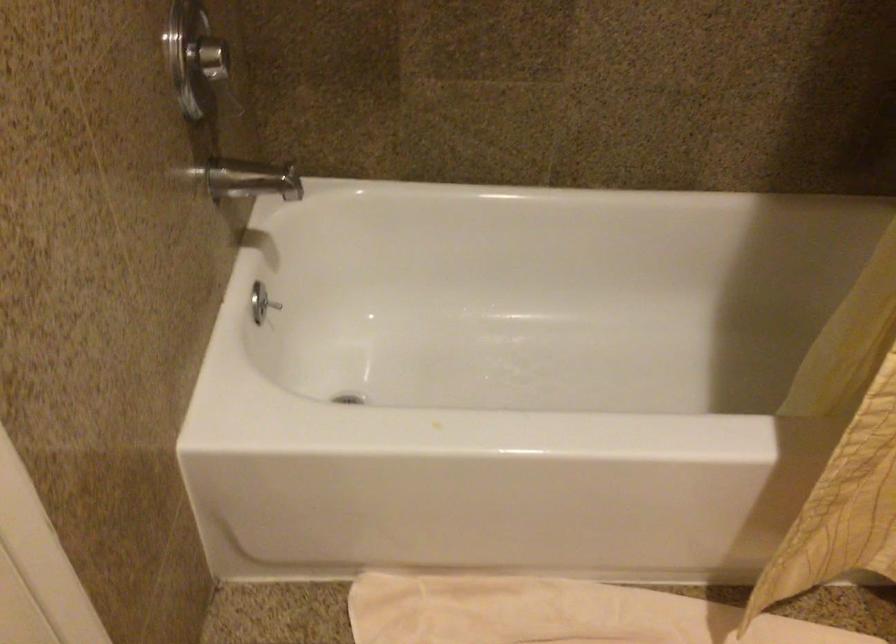
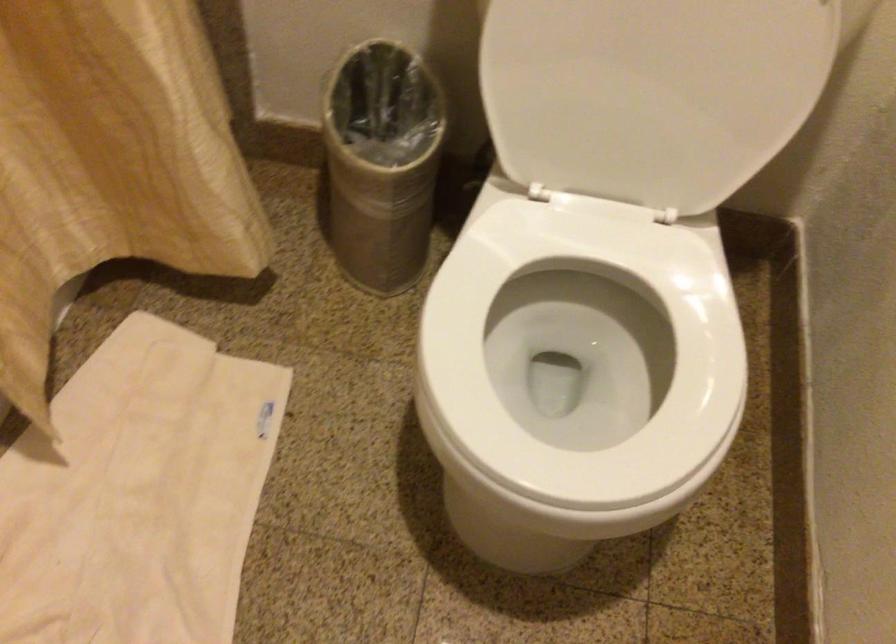
The first image is from the beginning of the video and the second image is from the end. How did the camera likely rotate when shooting the video?

The camera rotated toward right-down.